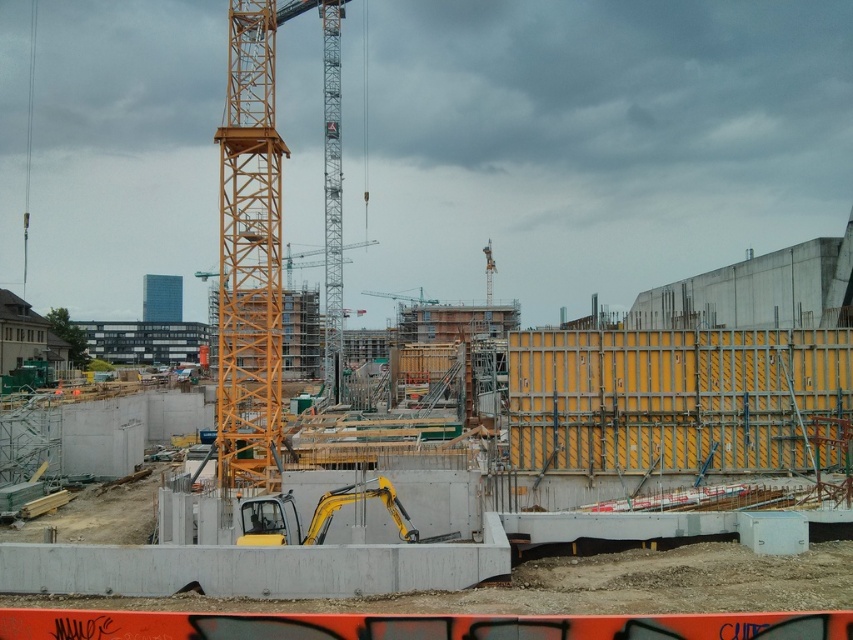
You are a construction worker standing at the edge of the construction site. You need to move a heavy beam that is 30 meters long to the yellow metallic tower crane at center. Can you safely transport the beam the entire distance without it hitting anything? Please explain your reasoning.

The distance between you and the yellow metallic tower crane at center is 31.64 meters. Since the beam is 30 meters long, it can be transported safely as the distance available is slightly longer than the beam. However, you must ensure there are no obstacles in the path and that the beam is properly secured during transportation.

You are a construction worker standing at the yellow excavator parked near a concrete barrier. You need to reach both the point at coordinates point [225,144] and point [345,496]. Which point should you go to first if you want to reach the one closer to you first?

You should go to point [225,144] first because it is closer to you than point [345,496].

You are a construction worker who needs to move a heavy load from the yellow metallic excavator at center to the yellow metallic tower crane at center. Which direction should you move the load to reach the crane?

You should move the load to the left from the yellow metallic excavator at center to reach the yellow metallic tower crane at center, since the yellow metallic tower crane at center is to the left of the yellow metallic excavator at center.